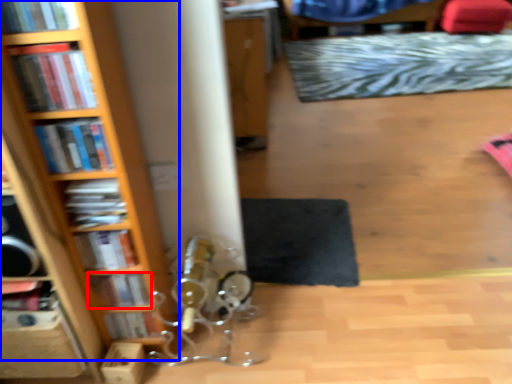
Question: Which object is further to the camera taking this photo, book (highlighted by a red box) or bookcase (highlighted by a blue box)?

Choices:
 (A) book
 (B) bookcase

Answer: (A)